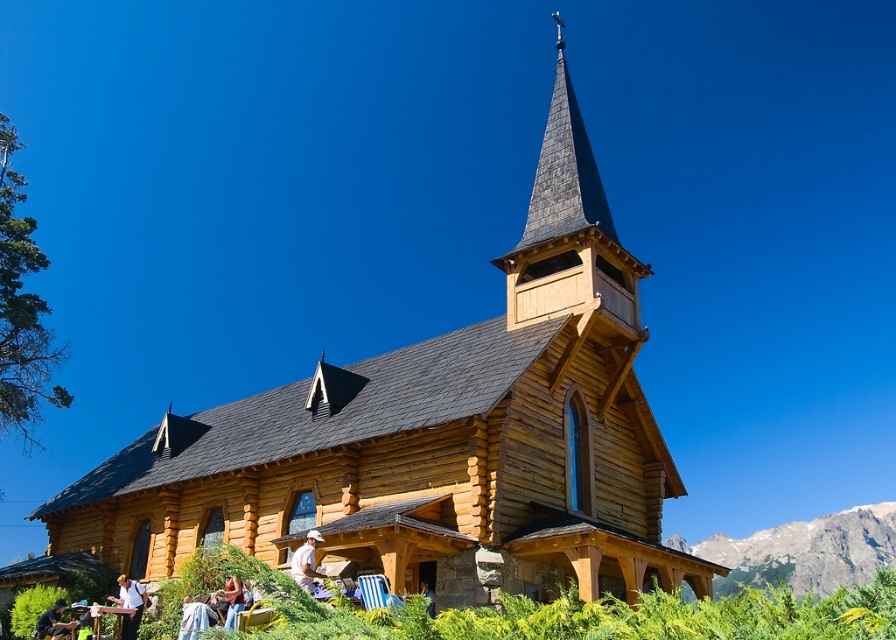
You are standing in front of the rustic wooden church and notice two white shirts hanging on hooks near the entrance. The white shirt at lower left and the white cotton shirt at lower center. Which shirt is closer to the ground?

The white cotton shirt at lower center is closer to the ground because it is shorter than the white shirt at lower left.

You are standing in front of the church and want to place the denim jacket at lower left on the green leafy hillside at lower right. Is the hillside large enough to accommodate the jacket?

The green leafy hillside at lower right has a larger size compared to the denim jacket at lower left, so yes, the hillside is large enough to accommodate the jacket.

You are standing in front of the rustic wooden church and want to take a photo of the steeple. There is a point at coordinates point (769,552) that is 190.65 meters away from you. Can you estimate whether this point is part of the steeple or the main church structure?

The point at coordinates point (769,552) is 190.65 meters away from the viewer. Since the steeple rises high above the main body of the church, it is likely that this point belongs to the steeple rather than the main structure.